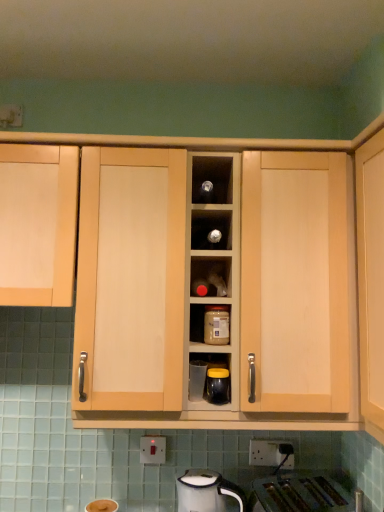
Question: Is light wood cabinet at left, which ranks as the second cabinetry in right-to-left order, inside the boundaries of white glossy electric kettle at lower center, or outside?

Choices:
 (A) inside
 (B) outside

Answer: (B)

Question: In terms of width, does light wood cabinet at left, which is counted as the first cabinetry, starting from the left, look wider or thinner when compared to white glossy electric kettle at lower center?

Choices:
 (A) wide
 (B) thin

Answer: (A)

Question: Estimate the real-world distances between objects in this image. Which object is closer to the clear glass jar at center, positioned as the first appliance in left-to-right order?

Choices:
 (A) light wood cabinet at center, positioned as the second cabinetry in left-to-right order
 (B) white plastic electric outlet at lower center
 (C) white glossy electric kettle at lower center
 (D) matte plastic jar at center
 (E) light wood cabinet at left, which is counted as the first cabinetry, starting from the left

Answer: (D)

Question: Estimate the real-world distances between objects in this image. Which object is farther from the white plastic electric outlet at lower center?

Choices:
 (A) white glossy electric kettle at lower center
 (B) matte plastic jar at center
 (C) matte black jar at center, the first appliance when ordered from front to back
 (D) light wood cabinet at left, which is counted as the first cabinetry, starting from the left
 (E) clear glass jar at center, the 2th appliance from the front

Answer: (D)